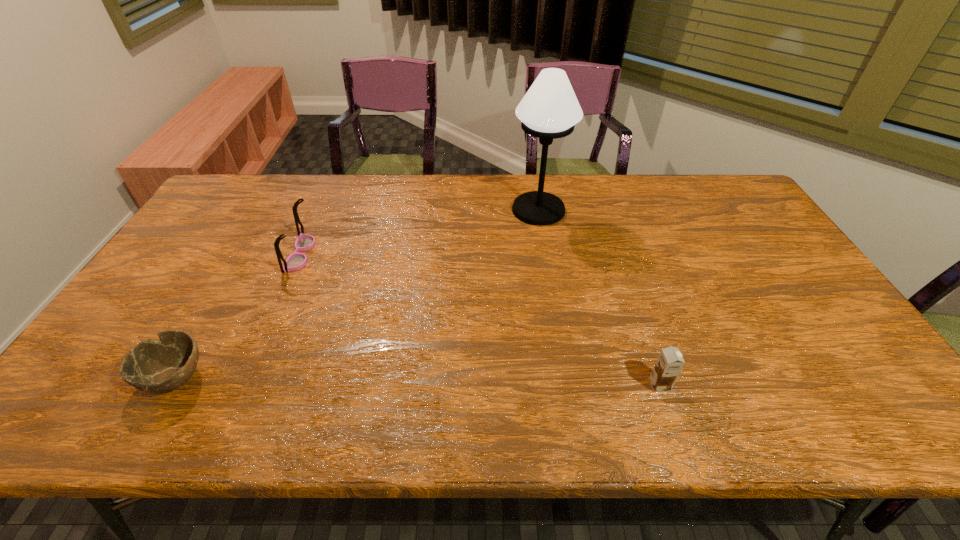
The height and width of the screenshot is (540, 960). I want to click on vacant point located between the second shortest object and the second object from right to left, so click(x=599, y=298).

In order to click on empty space between the third object from right to left and the second shortest object in this screenshot , I will do `click(480, 320)`.

This screenshot has height=540, width=960. I want to click on free space between the tallest object and the third nearest object, so coord(420,232).

Locate an element on the screen. free space between the shortest object and the second object from right to left is located at coordinates (357, 293).

Where is `empty space that is in between the second object from left to right and the table lamp`? The image size is (960, 540). empty space that is in between the second object from left to right and the table lamp is located at coordinates (420, 232).

You are a GUI agent. You are given a task and a screenshot of the screen. Output one action in this format:
    pyautogui.click(x=<x>, y=<y>)
    Task: Click on the vacant space in between the second object from right to left and the third nearest object
    The image size is (960, 540).
    Given the screenshot: What is the action you would take?
    pyautogui.click(x=420, y=232)

The width and height of the screenshot is (960, 540). What are the coordinates of `vacant area that lies between the rightmost object and the third object from right to left` in the screenshot? It's located at (480, 320).

In order to click on free space that is in between the second shortest object and the spectacles in this screenshot , I will do `click(480, 320)`.

Locate an element on the screen. This screenshot has height=540, width=960. empty space between the third nearest object and the table lamp is located at coordinates (420, 232).

The image size is (960, 540). Find the location of `free space between the chocolate milk and the table lamp`. free space between the chocolate milk and the table lamp is located at coordinates (599, 298).